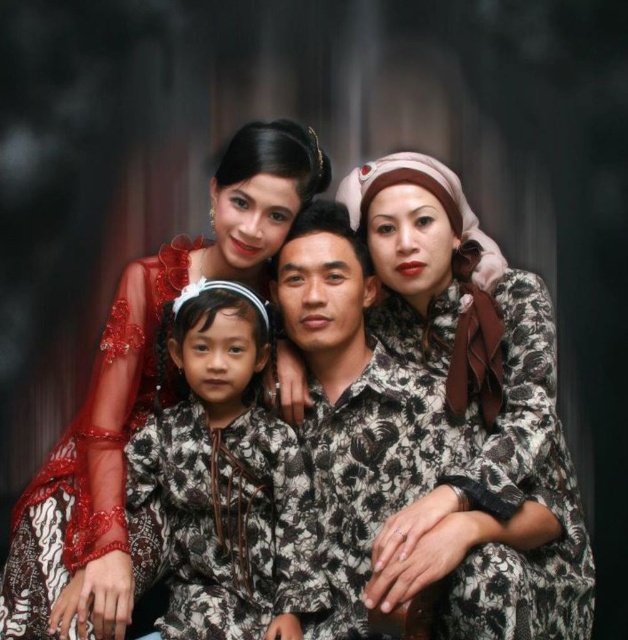
Looking at the family portrait, you notice two specific fabrics in the scene. The first is a printed fabric blouse at center, and the second is a matte red sheer fabric at upper left. Which of these fabrics is positioned higher up in the image?

The matte red sheer fabric at upper left is positioned higher up in the image than the printed fabric blouse at center.

Looking at the family portrait, which piece of clothing is closer to the viewer between the printed fabric blouse at center and the matte red sheer fabric at upper left?

The printed fabric blouse at center is closer to the viewer as it is positioned in front of the matte red sheer fabric at upper left.